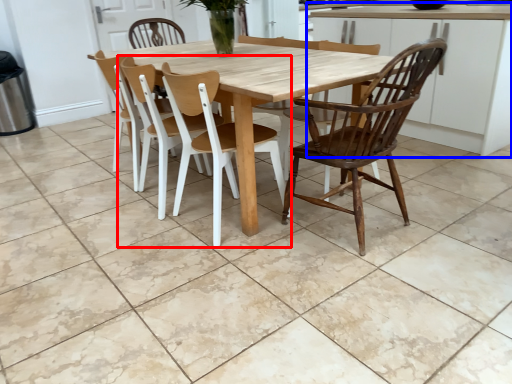
Question: Which point is further to the camera, chair (highlighted by a red box) or cabinetry (highlighted by a blue box)?

Choices:
 (A) chair
 (B) cabinetry

Answer: (A)